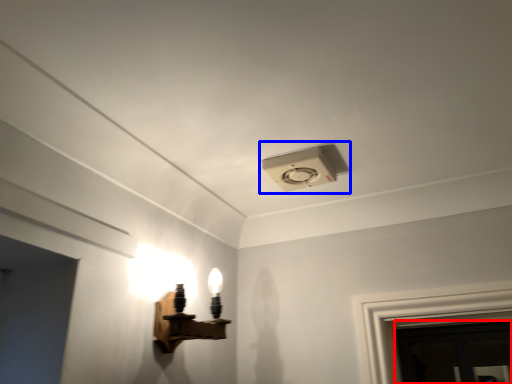
Question: Among these objects, which one is nearest to the camera, door (highlighted by a red box) or lamp (highlighted by a blue box)?

Choices:
 (A) door
 (B) lamp

Answer: (B)